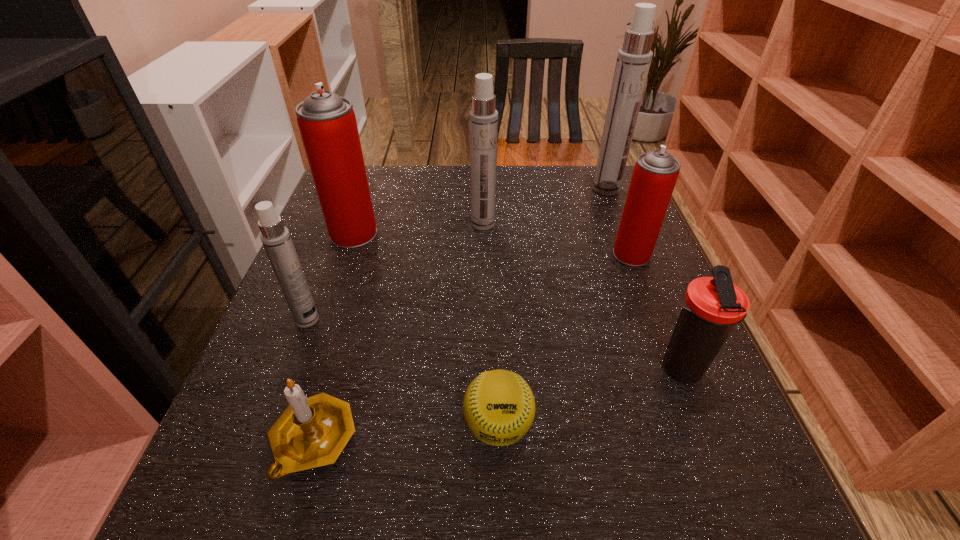
Find the location of a particular element. free space located on the right of the candle holder is located at coordinates (516, 441).

At what (x,y) coordinates should I click in order to perform the action: click on vacant position located 0.100m on the logo side of the yellow softball. Please return your answer as a coordinate pair (x, y). This screenshot has height=540, width=960. Looking at the image, I should click on (501, 531).

The width and height of the screenshot is (960, 540). Identify the location of object that is at the far edge. (633, 62).

Where is `object at the near edge`? This screenshot has height=540, width=960. object at the near edge is located at coordinates (312, 432).

Find the location of a particular element. The height and width of the screenshot is (540, 960). candle holder that is positioned at the left edge is located at coordinates (312, 432).

Where is `thermos bottle that is at the right edge`? thermos bottle that is at the right edge is located at coordinates (711, 306).

At what (x,y) coordinates should I click in order to perform the action: click on object located at the near left corner. Please return your answer as a coordinate pair (x, y). This screenshot has width=960, height=540. Looking at the image, I should click on (312, 432).

The height and width of the screenshot is (540, 960). I want to click on object located at the far right corner, so click(x=633, y=62).

In the image, there is a desktop. In order to click on free space at the far edge in this screenshot , I will do `click(498, 188)`.

You are a GUI agent. You are given a task and a screenshot of the screen. Output one action in this format:
    pyautogui.click(x=<x>, y=<y>)
    Task: Click on the free space at the near edge
    The width and height of the screenshot is (960, 540).
    Given the screenshot: What is the action you would take?
    (x=634, y=472)